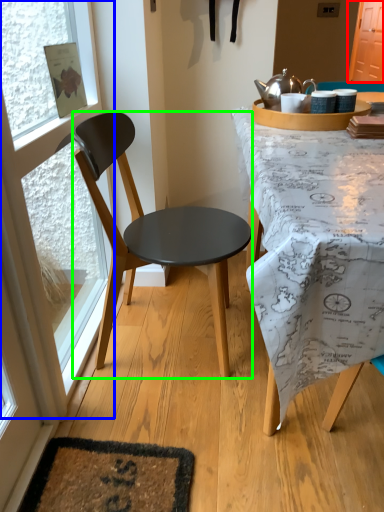
Question: Considering the real-world distances, which object is farthest from screen door (highlighted by a red box)? glass door (highlighted by a blue box) or chair (highlighted by a green box)?

Choices:
 (A) glass door
 (B) chair

Answer: (A)